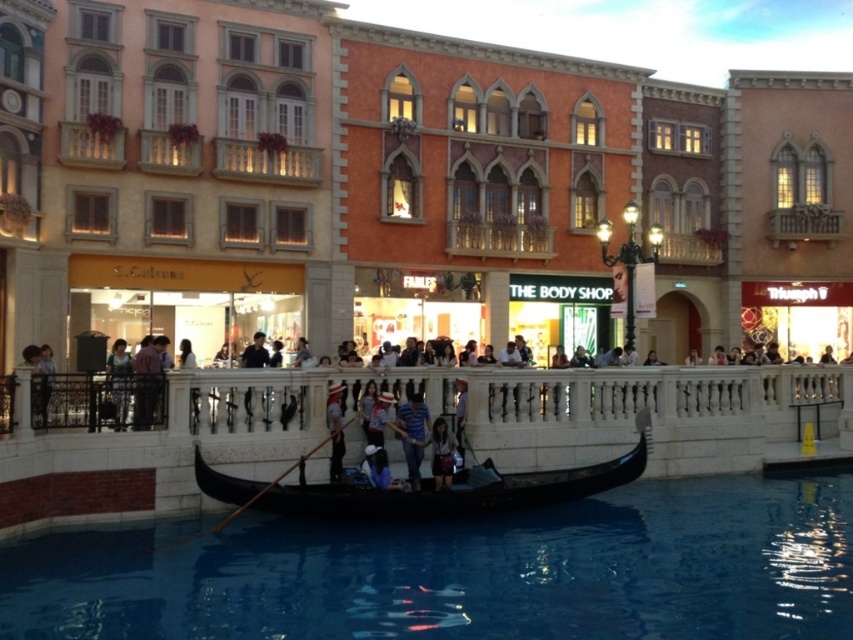
Can you confirm if matte orange building at center is positioned below black polished wood gondola at center?

Incorrect, matte orange building at center is not positioned below black polished wood gondola at center.

Is matte orange building at center further to camera compared to black polished wood gondola at center?

Yes, matte orange building at center is behind black polished wood gondola at center.

Who is more distant from viewer, (61,195) or (343,484)?

The point (61,195) is more distant.

At what (x,y) coordinates should I click in order to perform the action: click on matte orange building at center. Please return your answer as a coordinate pair (x, y). The width and height of the screenshot is (853, 640). Looking at the image, I should click on 398,186.

Is matte orange building at center below wooden paddle at center?

Incorrect, matte orange building at center is not positioned below wooden paddle at center.

Is matte orange building at center positioned at the back of wooden paddle at center?

Yes, matte orange building at center is behind wooden paddle at center.

This screenshot has width=853, height=640. Find the location of `matte orange building at center`. matte orange building at center is located at coordinates (398, 186).

This screenshot has height=640, width=853. I want to click on matte orange building at center, so coord(398,186).

Between point (169, 628) and point (412, 416), which one is positioned behind?

Positioned behind is point (412, 416).

Can you confirm if transparent glass water at center is positioned to the left of blue striped shirt at center?

In fact, transparent glass water at center is to the right of blue striped shirt at center.

Find the location of a particular element. transparent glass water at center is located at coordinates (463, 572).